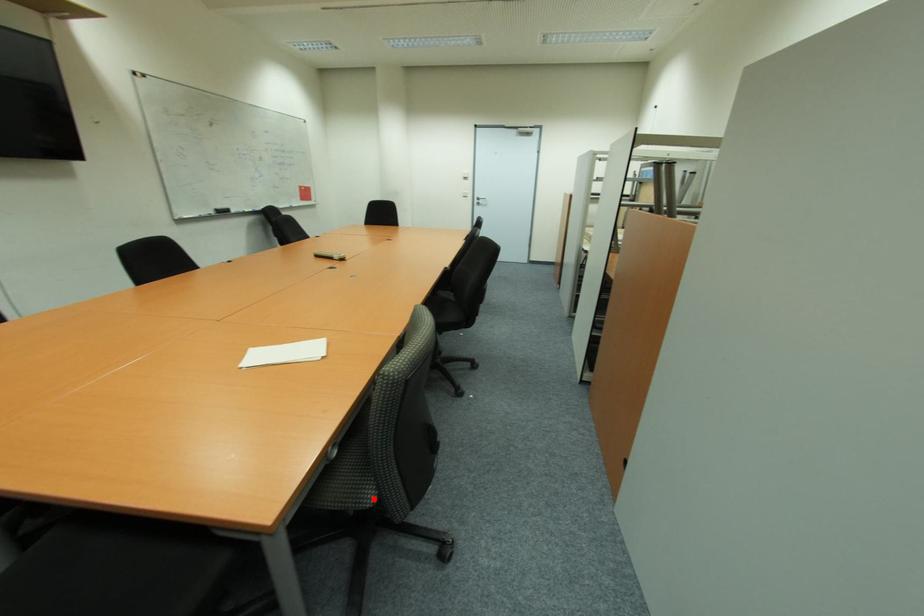
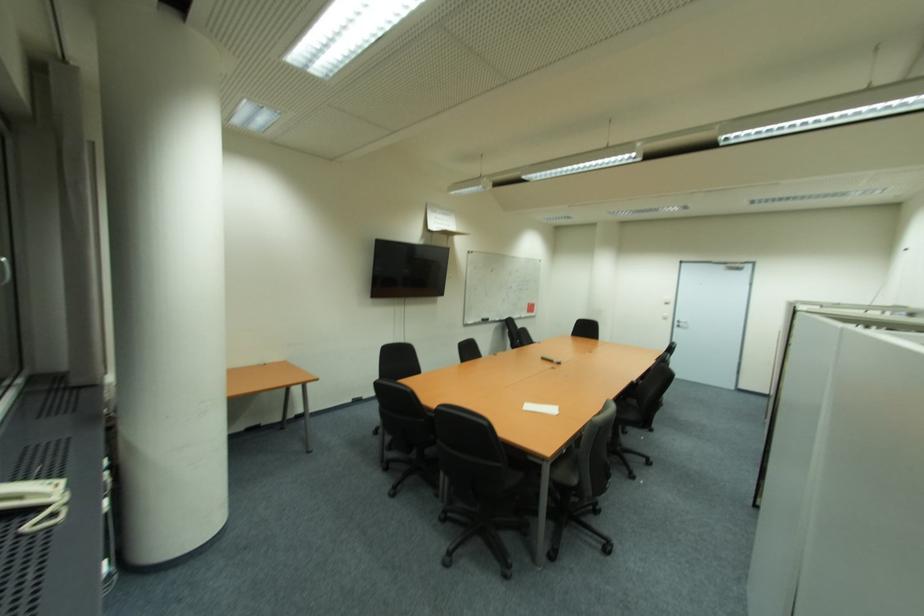
Find the pixel in the second image that matches the highlighted location in the first image.

(578, 482)